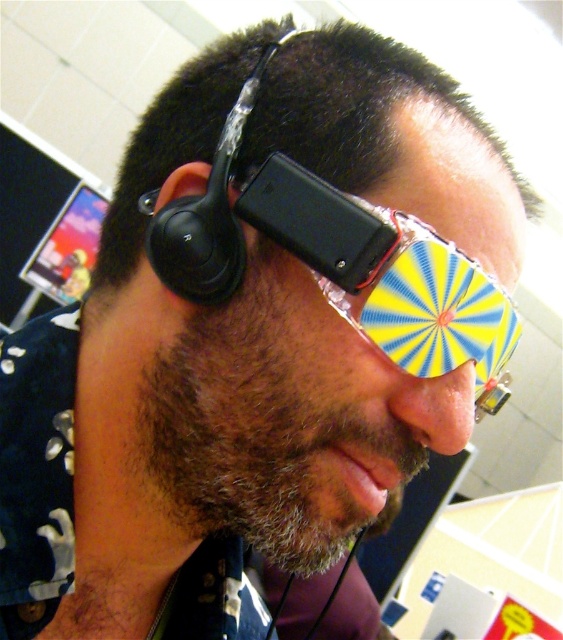
The image size is (563, 640). What do you see at coordinates (199, 241) in the screenshot?
I see `black matte earphone at left` at bounding box center [199, 241].

Between point (230, 205) and point (173, 173), which one is positioned in front?

Positioned in front is point (230, 205).

Between point (208, 289) and point (207, 163), which one is positioned behind?

Point (207, 163)

You are a GUI agent. You are given a task and a screenshot of the screen. Output one action in this format:
    pyautogui.click(x=<x>, y=<y>)
    Task: Click on the black matte earphone at left
    This screenshot has width=563, height=640.
    Given the screenshot: What is the action you would take?
    pyautogui.click(x=199, y=241)

Who is more distant from viewer, (453, 292) or (180, 188)?

Point (180, 188)

Can you confirm if translucent plastic goggles at center is shorter than black matte earbud at upper left?

In fact, translucent plastic goggles at center may be taller than black matte earbud at upper left.

Where is `translucent plastic goggles at center`? This screenshot has height=640, width=563. translucent plastic goggles at center is located at coordinates (390, 276).

Does translucent plastic goggles at center appear on the left side of black matte earphone at left?

No, translucent plastic goggles at center is not to the left of black matte earphone at left.

The height and width of the screenshot is (640, 563). Find the location of `translucent plastic goggles at center`. translucent plastic goggles at center is located at coordinates (390, 276).